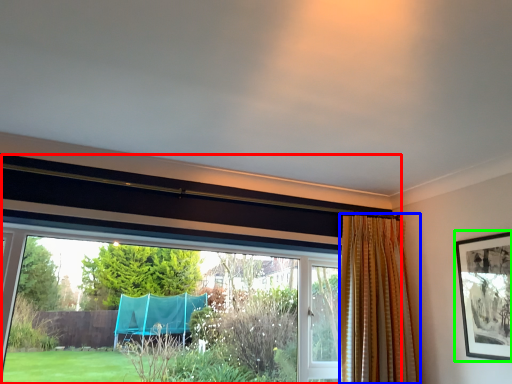
Question: Estimate the real-world distances between objects in this image. Which object is closer to window (highlighted by a red box), curtain (highlighted by a blue box) or picture frame (highlighted by a green box)?

Choices:
 (A) curtain
 (B) picture frame

Answer: (A)